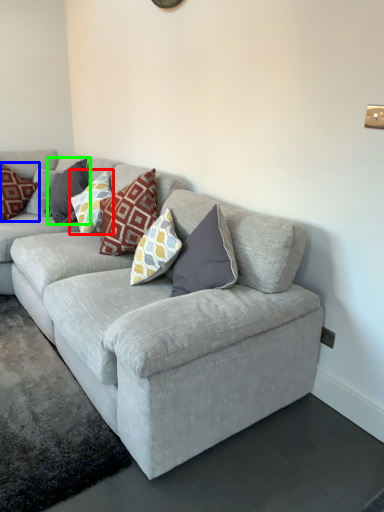
Question: Which object is the closest to the pillow (highlighted by a red box)? Choose among these: pillow (highlighted by a blue box) or pillow (highlighted by a green box).

Choices:
 (A) pillow
 (B) pillow

Answer: (B)